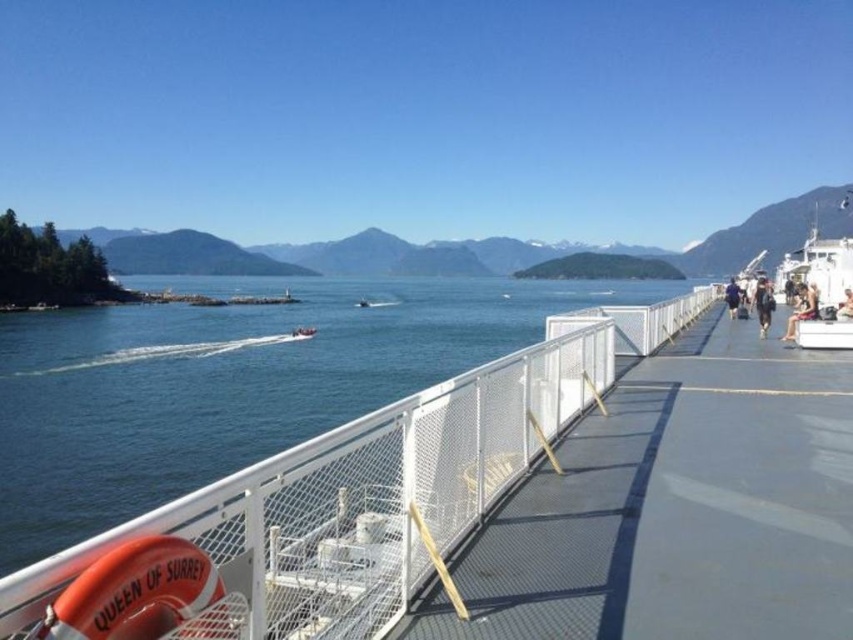
You are a photographer standing on the ferry deck. You want to take a photo of the distant islands while ensuring the white mesh fence at center and black fabric pants at right are in the frame. Which object will appear narrower in the photo?

The white mesh fence at center will appear narrower in the photo because it is thinner than the black fabric pants at right.

You are standing on the ferry deck and want to take a photo of the black fabric pants at right. To avoid including the white mesh fence at center in your photo, which direction should you move?

You should move to the right because the white mesh fence at center is to the left of the black fabric pants at right, so moving right will position the fence out of the frame.